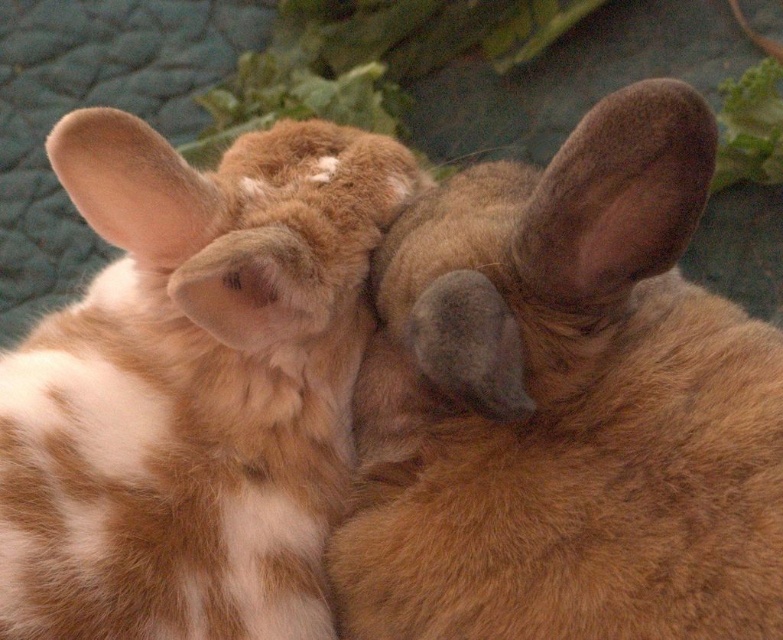
You are a wildlife photographer aiming to capture a closeup shot of both the brown furry rabbit at center and the fuzzy brown ear at upper left. Given that your camera can focus on subjects within a 10 inch range, will you be able to capture both in focus without adjusting your camera settings?

The brown furry rabbit at center and the fuzzy brown ear at upper left are 11.82 inches apart from each other. Since your camera can only focus within a 10 inch range, you will need to adjust your camera settings to ensure both are in focus.

Based on the photo, you are a photographer trying to capture a closeup of the rabbit on the left. You want to focus on the white patch on its chest, which is at point (514, 259). However, you notice another point (159, 240) in the image. Which point is closer to your camera lens?

Point (514, 259) is closer to the camera than point (159, 240), so the white patch on the rabbit on the left is in focus.

You are a photographer trying to focus on the brown furry ear at upper right. You notice a point marked at coordinates point (616,196). Is this point likely located on the brown furry ear at upper right?

Yes, the point (616,196) indicates the brown furry ear at upper right, so it is likely located on that ear.